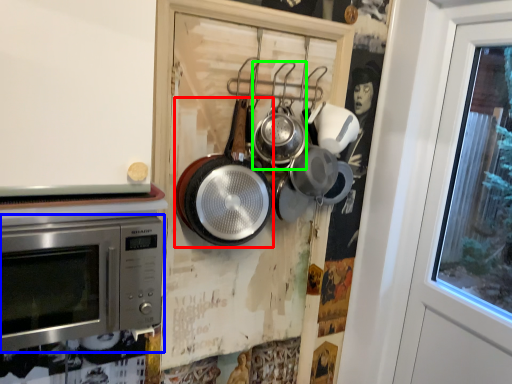
Question: Considering the real-world distances, which object is closest to frying pan (highlighted by a red box)? microwave oven (highlighted by a blue box) or frying pan (highlighted by a green box).

Choices:
 (A) microwave oven
 (B) frying pan

Answer: (B)